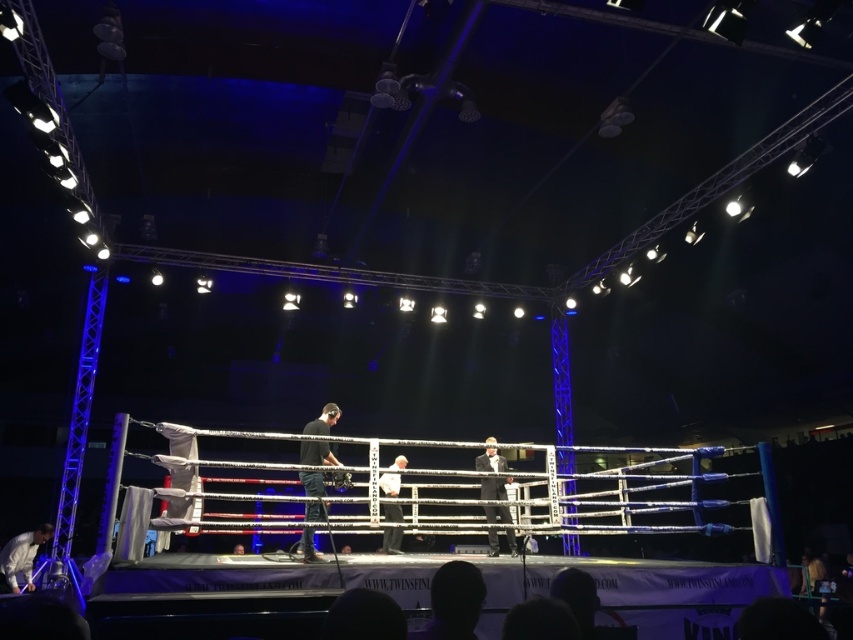
Which is in front, point (479, 467) or point (28, 561)?

Point (479, 467)

How far apart are shiny black suit at center and white fabric at lower left?

shiny black suit at center is 5.54 meters from white fabric at lower left.

Is point (494, 483) farther from camera compared to point (9, 588)?

No.

You are a GUI agent. You are given a task and a screenshot of the screen. Output one action in this format:
    pyautogui.click(x=<x>, y=<y>)
    Task: Click on the shiny black suit at center
    
    Given the screenshot: What is the action you would take?
    pyautogui.click(x=490, y=460)

Can you confirm if black matte camera at center is wider than white fabric at lower left?

In fact, black matte camera at center might be narrower than white fabric at lower left.

Between point (335, 408) and point (16, 556), which one is positioned behind?

Point (16, 556)

What are the coordinates of `black matte camera at center` in the screenshot? It's located at (316, 452).

Measure the distance between point [309,531] and camera.

A distance of 5.04 meters exists between point [309,531] and camera.

Which is in front, point (320, 513) or point (393, 458)?

Positioned in front is point (320, 513).

Locate an element on the screen. Image resolution: width=853 pixels, height=640 pixels. black matte camera at center is located at coordinates (316, 452).